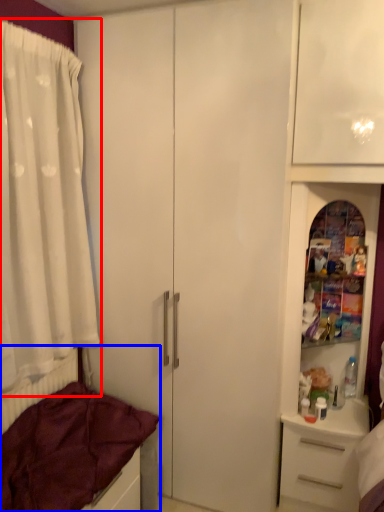
Question: Which of the following is the farthest to the observer, curtain (highlighted by a red box) or bed (highlighted by a blue box)?

Choices:
 (A) curtain
 (B) bed

Answer: (A)